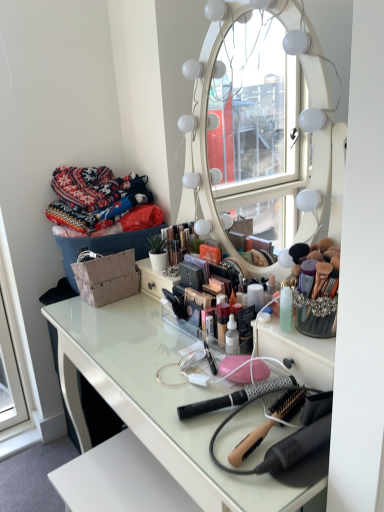
Locate an element on the screen. free space in front of black plastic brush at center, the 1th brush when ordered from back to front is located at coordinates pos(230,449).